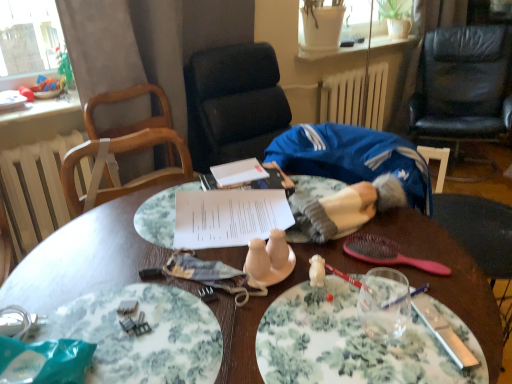
Where is `wooden table at upper left`? This screenshot has height=384, width=512. wooden table at upper left is located at coordinates (42, 109).

What is the approximate width of white paper at center?

The width of white paper at center is 12.78 inches.

Describe the element at coordinates (464, 85) in the screenshot. I see `black leather chair at upper right` at that location.

Identify the location of black leather chair at upper right. The image size is (512, 384). (464, 85).

What is the approximate width of wooden table at center?

The width of wooden table at center is 3.33 feet.

In order to face wooden table at center, should I rotate leftwards or rightwards?

Rotate left and turn 1.295 degrees.

Where is `pink plastic spoon at lower right`? pink plastic spoon at lower right is located at coordinates (387, 253).

From the picture: From the image's perspective, relative to white matte radiator at upper center, placed as the second radiator when sorted from left to right, is wooden table at center above or below?

Clearly, from the image's perspective, wooden table at center is below white matte radiator at upper center, placed as the second radiator when sorted from left to right.

Can you confirm if wooden table at center is shorter than white matte radiator at upper center, placed as the second radiator when sorted from left to right?

In fact, wooden table at center may be taller than white matte radiator at upper center, placed as the second radiator when sorted from left to right.

Who is smaller, wooden table at center or white matte radiator at upper center, which appears as the 1th radiator when viewed from the top?

With smaller size is white matte radiator at upper center, which appears as the 1th radiator when viewed from the top.

In the scene shown: Is wooden table at center at the left side of white matte radiator at upper center, placed as the second radiator when sorted from left to right?

Yes.

How different are the orientations of pink plastic spoon at lower right and wooden table at upper left in degrees?

The angle between the facing direction of pink plastic spoon at lower right and the facing direction of wooden table at upper left is 112 degrees.

Is pink plastic spoon at lower right bigger than wooden table at upper left?

No, pink plastic spoon at lower right is not bigger than wooden table at upper left.

Considering the positions of objects pink plastic spoon at lower right and wooden table at upper left in the image provided, who is more to the left, pink plastic spoon at lower right or wooden table at upper left?

wooden table at upper left.

Considering the relative sizes of pink plastic spoon at lower right and wooden table at upper left in the image provided, is pink plastic spoon at lower right wider than wooden table at upper left?

In fact, pink plastic spoon at lower right might be narrower than wooden table at upper left.

Considering the relative positions of wooden table at upper left and white radiator at left, the 1th radiator ordered from the bottom, in the image provided, is wooden table at upper left behind white radiator at left, the 1th radiator ordered from the bottom,?

No, wooden table at upper left is closer to the camera.

In the scene shown: Which object is wider, wooden table at upper left or white radiator at left, the first radiator viewed from the front?

With larger width is wooden table at upper left.

How different are the orientations of white radiator at left, arranged as the second radiator when viewed from the top, and floral ceramic plate at center, the second plate viewed from the left, in degrees?

The angular difference between white radiator at left, arranged as the second radiator when viewed from the top, and floral ceramic plate at center, the second plate viewed from the left, is 90.5 degrees.

Does white radiator at left, which appears as the 2th radiator when viewed from the back, come behind floral ceramic plate at center, marked as the first plate in a right-to-left arrangement?

A: That is True.

From the image's perspective, between white radiator at left, the first radiator viewed from the front, and floral ceramic plate at center, the second plate viewed from the left, which one is located above?

From the image's view, white radiator at left, the first radiator viewed from the front, is above.

Is white radiator at left, the first radiator viewed from the front, oriented away from floral ceramic plate at center, the second plate viewed from the left?

white radiator at left, the first radiator viewed from the front, does not have its back to floral ceramic plate at center, the second plate viewed from the left.

Is white matte radiator at upper center, which appears as the 1th radiator when viewed from the top, not near pink plastic spoon at lower right?

white matte radiator at upper center, which appears as the 1th radiator when viewed from the top, is far away from pink plastic spoon at lower right.

From the image's perspective, is white matte radiator at upper center, which ranks as the 2th radiator in bottom-to-top order, over pink plastic spoon at lower right?

Yes, from the image's perspective, white matte radiator at upper center, which ranks as the 2th radiator in bottom-to-top order, is on top of pink plastic spoon at lower right.

Can you confirm if white matte radiator at upper center, which ranks as the 2th radiator in bottom-to-top order, is wider than pink plastic spoon at lower right?

Yes, white matte radiator at upper center, which ranks as the 2th radiator in bottom-to-top order, is wider than pink plastic spoon at lower right.

What's the angular difference between white matte radiator at upper center, the 2th radiator positioned from the front, and pink plastic spoon at lower right's facing directions?

There is a 111-degree angle between the facing directions of white matte radiator at upper center, the 2th radiator positioned from the front, and pink plastic spoon at lower right.

Based on the photo, is black leather chair at upper right not within white paper at center?

Yes, black leather chair at upper right is located beyond the bounds of white paper at center.

Looking at this image, from a real-world perspective, between black leather chair at upper right and white paper at center, who is vertically higher?

In real-world perspective, white paper at center is above.

Considering the positions of points (426, 34) and (269, 191), is point (426, 34) closer to camera compared to point (269, 191)?

No, (426, 34) is further to viewer.

Relative to wooden table at upper left, is black leather chair at upper right in front or behind?

Clearly, black leather chair at upper right is behind wooden table at upper left.

Is black leather chair at upper right with wooden table at upper left?

black leather chair at upper right and wooden table at upper left are not in contact.

This screenshot has width=512, height=384. Find the location of `chair on the right of wooden table at upper left`. chair on the right of wooden table at upper left is located at coordinates (464, 85).

This screenshot has height=384, width=512. I want to click on the 2nd radiator above the wooden table at center (from the image's perspective), so click(x=355, y=96).

Where is `kitchen & dining room table above the pink plastic spoon at lower right (from a real-world perspective)`? kitchen & dining room table above the pink plastic spoon at lower right (from a real-world perspective) is located at coordinates (42, 109).

Looking at the image, which one is located further to wooden table at upper left, pink plastic spoon at lower right or white paper at center?

Based on the image, pink plastic spoon at lower right appears to be further to wooden table at upper left.

Based on their spatial positions, is silver metallic knife at lower right or white matte radiator at upper center, which is counted as the 1th radiator, starting from the back, closer to white paper at center?

silver metallic knife at lower right lies closer to white paper at center than the other object.

Which object lies nearer to the anchor point wooden table at upper left, white paper at center or pink plastic spoon at lower right?

Based on the image, white paper at center appears to be nearer to wooden table at upper left.

From the image, which object appears to be nearer to black leather chair at upper right, white matte radiator at upper center, which ranks as the 2th radiator in bottom-to-top order, or floral-patterned plate at lower left, which is counted as the 2th plate, starting from the right?

Based on the image, white matte radiator at upper center, which ranks as the 2th radiator in bottom-to-top order, appears to be nearer to black leather chair at upper right.

Which object lies further to the anchor point wooden table at upper left, white matte radiator at upper center, placed as the second radiator when sorted from left to right, or pink plastic spoon at lower right?

white matte radiator at upper center, placed as the second radiator when sorted from left to right, lies further to wooden table at upper left than the other object.

Looking at the image, which one is located further to white ceramic salt and pepper shakers at center, white paper at center or floral-patterned plate at lower left, the first plate viewed from the left?

Based on the image, floral-patterned plate at lower left, the first plate viewed from the left, appears to be further to white ceramic salt and pepper shakers at center.

Considering their positions, is pink plastic spoon at lower right positioned further to floral ceramic plate at center, marked as the first plate in a right-to-left arrangement, than silver metallic knife at lower right?

pink plastic spoon at lower right is positioned further to the anchor floral ceramic plate at center, marked as the first plate in a right-to-left arrangement.

From the image, which object appears to be nearer to white paper at center, wooden table at center or floral-patterned plate at lower left, which is counted as the 2th plate, starting from the right?

wooden table at center.

This screenshot has height=384, width=512. I want to click on spoon between silver metallic knife at lower right and white matte radiator at upper center, which is counted as the 1th radiator, starting from the back, from front to back, so click(x=387, y=253).

You are a GUI agent. You are given a task and a screenshot of the screen. Output one action in this format:
    pyautogui.click(x=<x>, y=<y>)
    Task: Click on the desk between wooden table at upper left and black leather chair at upper right
    
    Given the screenshot: What is the action you would take?
    pyautogui.click(x=85, y=257)

The width and height of the screenshot is (512, 384). I want to click on spoon between wooden table at center and white paper at center in the front-back direction, so click(x=387, y=253).

At what (x,y) coordinates should I click in order to perform the action: click on desk located between floral-patterned plate at lower left, which is counted as the 2th plate, starting from the right, and pink plastic spoon at lower right in the left-right direction. Please return your answer as a coordinate pair (x, y). The image size is (512, 384). Looking at the image, I should click on (85, 257).